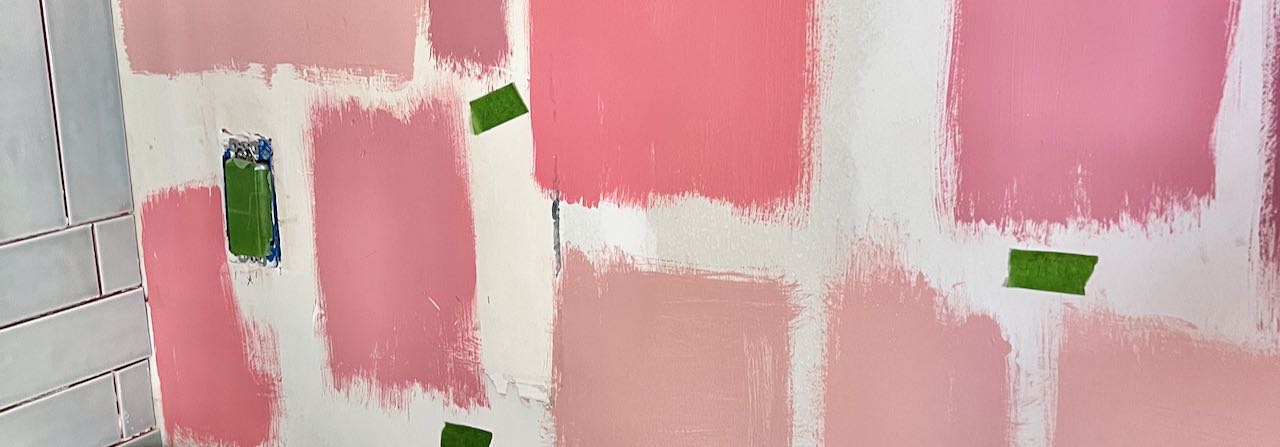
This screenshot has height=447, width=1280. What are the coordinates of `the lowest wall tile` in the screenshot? It's located at (151, 435).